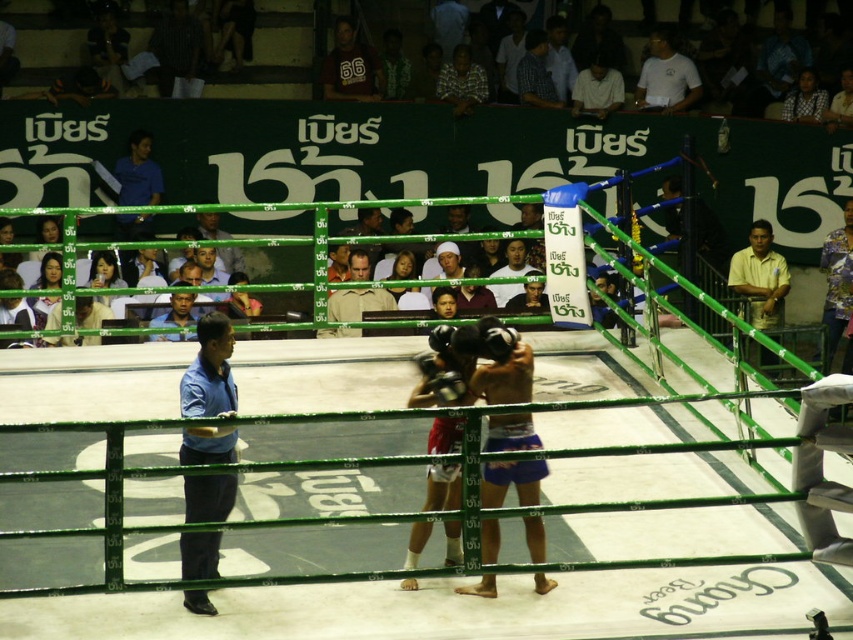
Question: Which point is farther from the camera taking this photo?

Choices:
 (A) (543, 33)
 (B) (730, 275)
 (C) (212, 218)
 (D) (207, 605)

Answer: (A)

Question: Is checkered fabric shirt at upper center bigger than light brown leather jacket at upper center?

Choices:
 (A) yes
 (B) no

Answer: (A)

Question: Observing the image, what is the correct spatial positioning of yellow matte shirt at right in reference to checkered fabric shirt at upper center?

Choices:
 (A) left
 (B) right

Answer: (B)

Question: Does blue shirt at left appear over light brown shirt at center?

Choices:
 (A) no
 (B) yes

Answer: (A)

Question: Considering the real-world distances, which object is farthest from the blue shirt at left?

Choices:
 (A) light brown shirt at center
 (B) yellow matte shirt at right
 (C) checkered fabric shirt at upper center
 (D) light brown wooden chair at upper center

Answer: (D)

Question: Which of the following is the farthest from the observer?

Choices:
 (A) light brown leather jacket at upper center
 (B) checkered fabric shirt at upper center
 (C) yellow matte shirt at right
 (D) light brown shirt at center

Answer: (B)